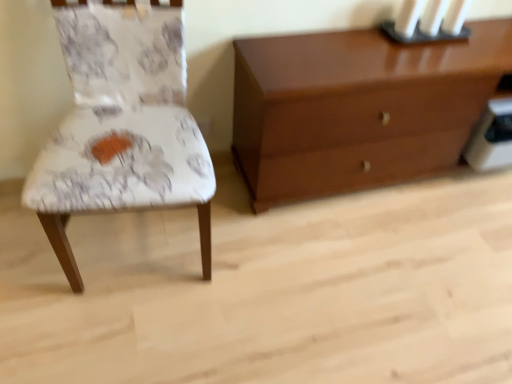
Locate an element on the screen. free region under white fabric chair at left (from a real-world perspective) is located at coordinates (137, 249).